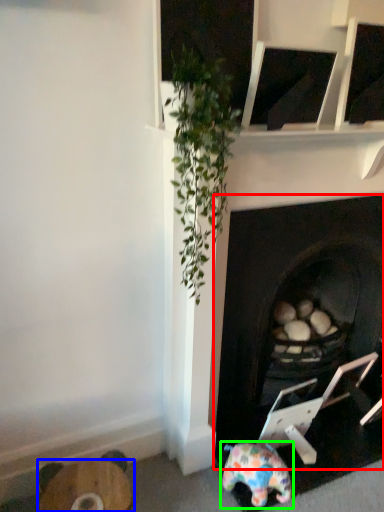
Question: Which object is positioned closest to fireplace (highlighted by a red box)? Select from furniture (highlighted by a blue box) and toy (highlighted by a green box).

Choices:
 (A) furniture
 (B) toy

Answer: (B)